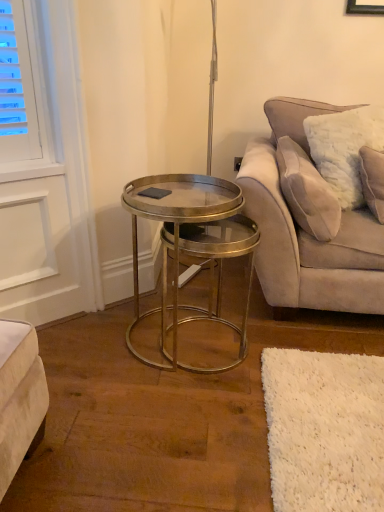
What do you see at coordinates (191, 246) in the screenshot?
I see `metallic/glass coffee table at center` at bounding box center [191, 246].

Find the location of a particular element. The height and width of the screenshot is (512, 384). white fluffy pillow at upper right is located at coordinates (307, 192).

You are a GUI agent. You are given a task and a screenshot of the screen. Output one action in this format:
    pyautogui.click(x=<x>, y=<y>)
    Task: Click on the velvet beige couch at right
    Image resolution: width=384 pixels, height=512 pixels.
    Given the screenshot: What is the action you would take?
    pyautogui.click(x=311, y=222)

Is white fluffy pillow at upper right bigger than metallic/glass coffee table at center?

No.

In the scene shown: From a real-world perspective, is white fluffy pillow at upper right located beneath metallic/glass coffee table at center?

No.

Considering the relative sizes of white fluffy pillow at upper right and metallic/glass coffee table at center in the image provided, is white fluffy pillow at upper right taller than metallic/glass coffee table at center?

No, white fluffy pillow at upper right is not taller than metallic/glass coffee table at center.

Which object is positioned more to the right, white fluffy pillow at upper right or metallic/glass coffee table at center?

From the viewer's perspective, white fluffy pillow at upper right appears more on the right side.

In the image, is velvet beige couch at right positioned in front of or behind metallic/glass coffee table at center?

Visually, velvet beige couch at right is located behind metallic/glass coffee table at center.

From the image's perspective, is velvet beige couch at right located beneath metallic/glass coffee table at center?

Actually, velvet beige couch at right appears above metallic/glass coffee table at center in the image.

Is velvet beige couch at right positioned with its back to metallic/glass coffee table at center?

No, velvet beige couch at right is not facing the opposite direction of metallic/glass coffee table at center.

Who is taller, velvet beige couch at right or white fluffy pillow at upper right?

Answer: velvet beige couch at right.

Is the position of velvet beige couch at right more distant than that of white fluffy pillow at upper right?

No, velvet beige couch at right is closer to the camera.

Can you confirm if velvet beige couch at right is positioned to the left of white fluffy pillow at upper right?

No.

Is point (297, 240) behind point (335, 216)?

Yes, point (297, 240) is behind point (335, 216).

Based on the photo, in terms of size, does white fluffy pillow at upper right appear bigger or smaller than velvet beige couch at right?

Clearly, white fluffy pillow at upper right is smaller in size than velvet beige couch at right.

Would you say white fluffy pillow at upper right is to the left or to the right of velvet beige couch at right in the picture?

Clearly, white fluffy pillow at upper right is on the left of velvet beige couch at right in the image.

The width and height of the screenshot is (384, 512). What are the coordinates of `studio couch lying in front of the white fluffy pillow at upper right` in the screenshot? It's located at (311, 222).

From a real-world perspective, which object rests below the other?

velvet beige couch at right, from a real-world perspective.

Considering the positions of points (145, 180) and (287, 144), is point (145, 180) farther from camera compared to point (287, 144)?

No, it is in front of (287, 144).

Does metallic/glass coffee table at center come behind white fluffy pillow at upper right?

No, it is not.

Is white fluffy pillow at upper right completely or partially inside metallic/glass coffee table at center?

No, metallic/glass coffee table at center does not contain white fluffy pillow at upper right.

Considering the positions of points (229, 226) and (328, 251), is point (229, 226) closer to camera compared to point (328, 251)?

Yes, it is in front of point (328, 251).

Is metallic/glass coffee table at center touching velvet beige couch at right?

metallic/glass coffee table at center and velvet beige couch at right are not in contact.

Is velvet beige couch at right a part of metallic/glass coffee table at center?

No, velvet beige couch at right is located outside of metallic/glass coffee table at center.

Find the location of a particular element. coffee table on the left of white fluffy pillow at upper right is located at coordinates (191, 246).

Find the location of a particular element. This screenshot has height=512, width=384. studio couch to the right of metallic/glass coffee table at center is located at coordinates (311, 222).

Based on their spatial positions, is metallic/glass coffee table at center or velvet beige couch at right further from white fluffy pillow at upper right?

metallic/glass coffee table at center.

Looking at the image, which one is located closer to velvet beige couch at right, white fluffy pillow at upper right or metallic/glass coffee table at center?

The object closer to velvet beige couch at right is white fluffy pillow at upper right.

Based on the photo, estimate the real-world distances between objects in this image. Which object is closer to metallic/glass coffee table at center, velvet beige couch at right or white fluffy pillow at upper right?

velvet beige couch at right lies closer to metallic/glass coffee table at center than the other object.

Looking at the image, which one is located further to metallic/glass coffee table at center, white fluffy pillow at upper right or velvet beige couch at right?

white fluffy pillow at upper right is further to metallic/glass coffee table at center.

Consider the image. Considering their positions, is metallic/glass coffee table at center positioned further to velvet beige couch at right than white fluffy pillow at upper right?

metallic/glass coffee table at center lies further to velvet beige couch at right than the other object.

Based on their spatial positions, is velvet beige couch at right or metallic/glass coffee table at center closer to white fluffy pillow at upper right?

Based on the image, velvet beige couch at right appears to be nearer to white fluffy pillow at upper right.

I want to click on pillow between metallic/glass coffee table at center and velvet beige couch at right, so click(x=307, y=192).